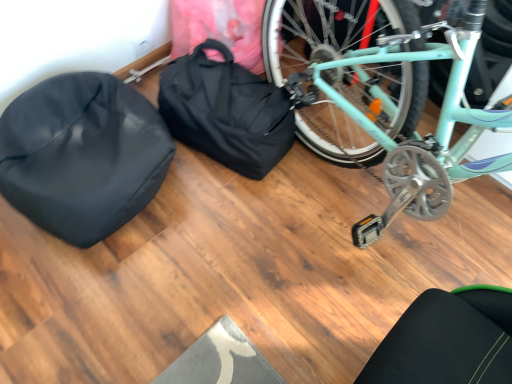
Question: Is black fabric bag at center at the left side of black matte sleeping bag at left?

Choices:
 (A) no
 (B) yes

Answer: (A)

Question: From a real-world perspective, is black fabric bag at center under black matte sleeping bag at left?

Choices:
 (A) yes
 (B) no

Answer: (A)

Question: From a real-world perspective, is black fabric bag at center on top of black matte sleeping bag at left?

Choices:
 (A) no
 (B) yes

Answer: (A)

Question: Is the depth of black fabric bag at center greater than that of black matte sleeping bag at left?

Choices:
 (A) yes
 (B) no

Answer: (A)

Question: Is black fabric bag at center wider than black matte sleeping bag at left?

Choices:
 (A) yes
 (B) no

Answer: (B)

Question: Can you confirm if black fabric bag at center is positioned to the right of black matte sleeping bag at left?

Choices:
 (A) no
 (B) yes

Answer: (B)

Question: Is black matte sleeping bag at left to the left of black fabric bag at center from the viewer's perspective?

Choices:
 (A) yes
 (B) no

Answer: (A)

Question: Does black matte sleeping bag at left have a greater width compared to black fabric bag at center?

Choices:
 (A) yes
 (B) no

Answer: (A)

Question: Is black matte sleeping bag at left thinner than black fabric bag at center?

Choices:
 (A) yes
 (B) no

Answer: (B)

Question: From a real-world perspective, is black matte sleeping bag at left positioned under black fabric bag at center based on gravity?

Choices:
 (A) yes
 (B) no

Answer: (B)

Question: Is black matte sleeping bag at left placed right next to black fabric bag at center?

Choices:
 (A) yes
 (B) no

Answer: (B)

Question: Can you confirm if black matte sleeping bag at left is taller than black fabric bag at center?

Choices:
 (A) no
 (B) yes

Answer: (A)

Question: Is point (216, 46) closer or farther from the camera than point (20, 193)?

Choices:
 (A) farther
 (B) closer

Answer: (A)